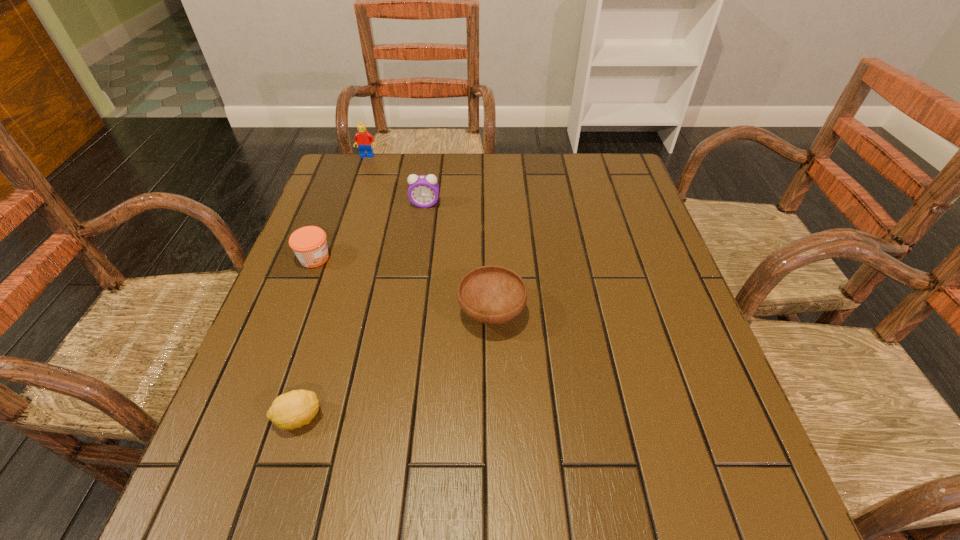
Find the location of a particular element. vacant space at the left edge is located at coordinates click(322, 302).

Identify the location of vacant region at the right edge of the desktop. (603, 228).

This screenshot has width=960, height=540. In the image, there is a desktop. What are the coordinates of `vacant space at the far left corner` in the screenshot? It's located at pyautogui.click(x=350, y=197).

Where is `free space at the near left corner of the desktop`? free space at the near left corner of the desktop is located at coordinates (283, 525).

Where is `free space between the rightmost object and the fourth object from left to right`? The height and width of the screenshot is (540, 960). free space between the rightmost object and the fourth object from left to right is located at coordinates (458, 259).

Identify the location of vacant region between the bowl and the tallest object. This screenshot has height=540, width=960. (429, 234).

You are a GUI agent. You are given a task and a screenshot of the screen. Output one action in this format:
    pyautogui.click(x=<x>, y=<y>)
    Task: Click on the free spot between the alarm clock and the jam
    The image size is (960, 540).
    Given the screenshot: What is the action you would take?
    pyautogui.click(x=370, y=231)

Where is `free spot between the Lego and the lemon`? Image resolution: width=960 pixels, height=540 pixels. free spot between the Lego and the lemon is located at coordinates [x=333, y=287].

Locate an element on the screen. free point between the nearest object and the farthest object is located at coordinates (333, 287).

Where is `vacant area between the third farthest object and the farthest object`? vacant area between the third farthest object and the farthest object is located at coordinates (341, 207).